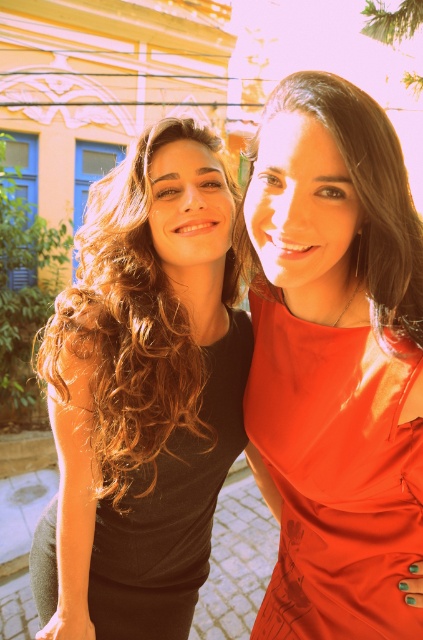
You are a photographer trying to capture a photo of both the matte black dress at left and the matte red dress at center. Since you want to ensure both are in focus, which dress should you focus on first to account for their positions?

You should focus on the matte black dress at left first because it is closer to you than the matte red dress at center, so adjusting focus from near to far will help both be in focus.